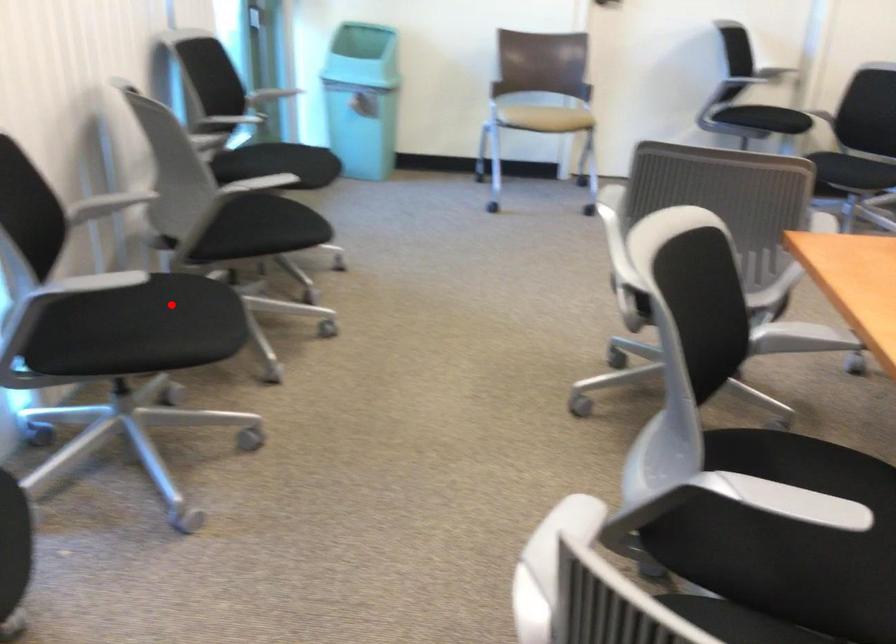
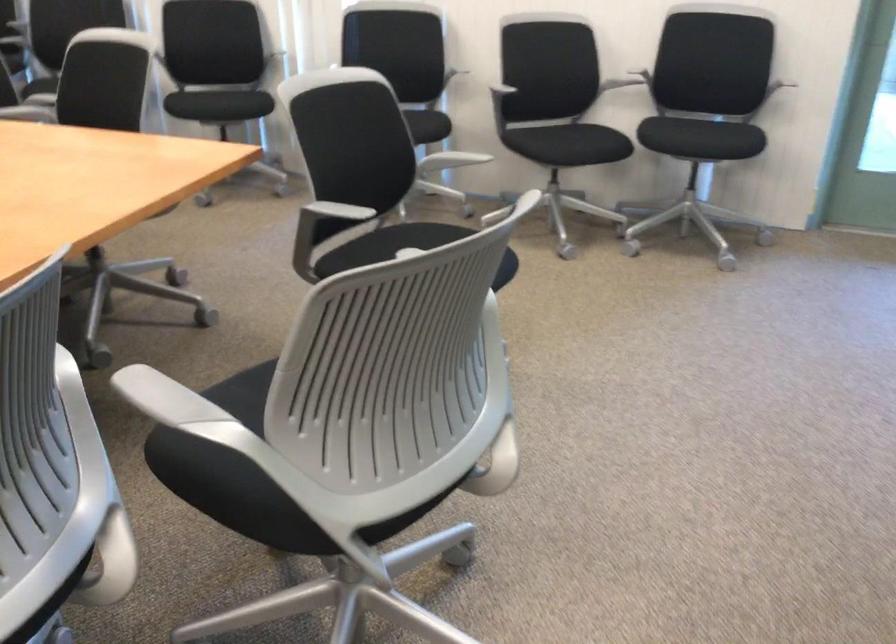
Question: A red point is marked in image1. In image2, is the corresponding 3D point closer to the camera or farther? Reply with the corresponding letter.

Choices:
 (A) The corresponding 3D point is closer.
 (B) The corresponding 3D point is farther.

Answer: (B)